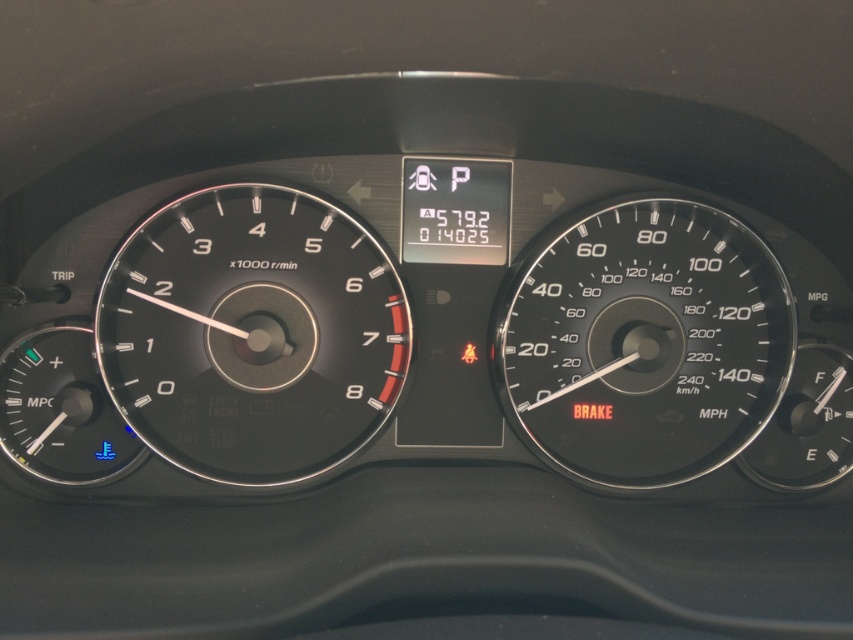
You are a driver who wants to check both the black matte speedometer at center and the black plastic speedometer at center right. Which one do you need to look at first to determine if the car is moving?

The black matte speedometer at center has a greater height compared to the black plastic speedometer at center right. Since the speedometer indicates the car is stationary, you should first check the black matte speedometer at center because it is taller and more prominent, making it easier to see quickly.

You are driving a car and want to check both the black matte speedometer at center and the black plastic speedometer at center right. Which one should you look at first if you want to check your current speed?

The black matte speedometer at center is to the left of the black plastic speedometer at center right. Since the speedometer typically indicates speed, you should look at the black matte speedometer at center first to check your current speed.